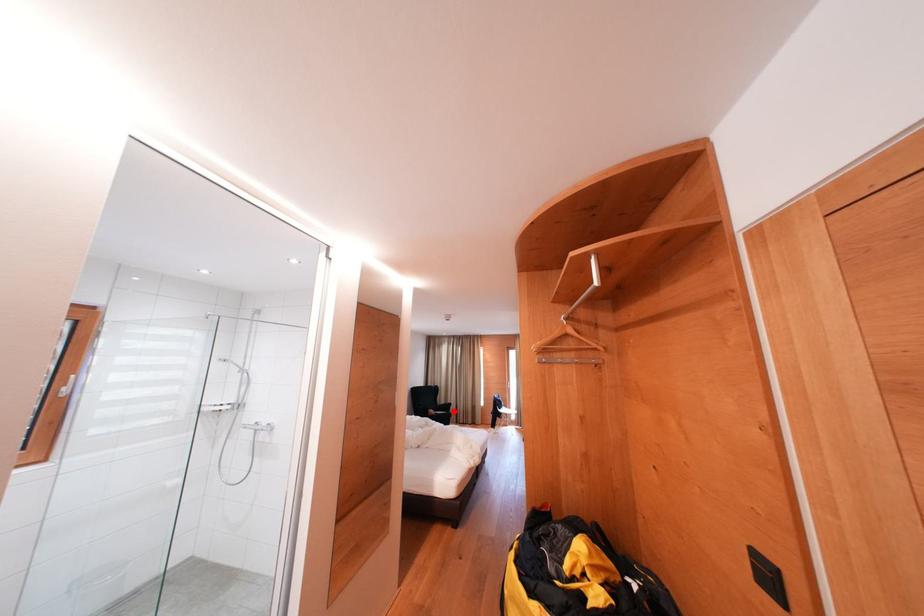
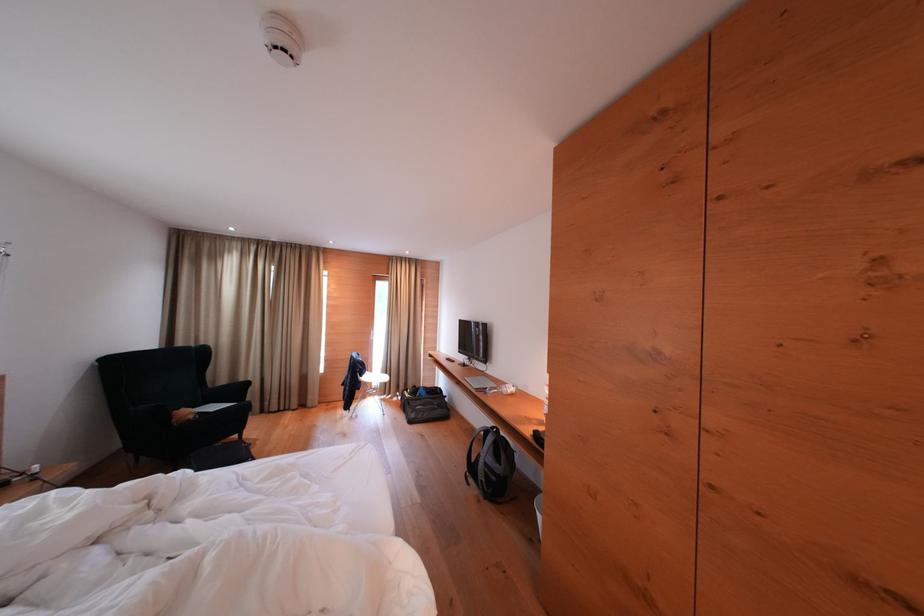
Question: I am providing you with two images of the same scene from different viewpoints. In image1, a red point is highlighted. Considering the same 3D point in image2, which of the following is correct?

Choices:
 (A) It is closer
 (B) It is farther

Answer: (A)